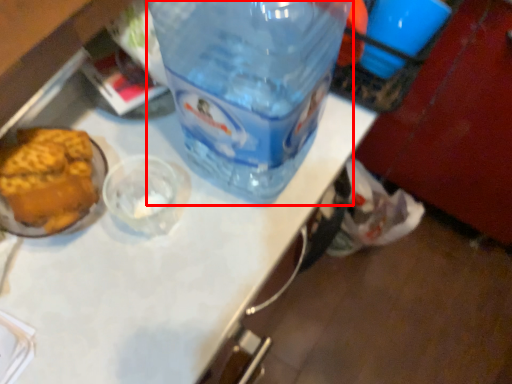
Question: From the image's perspective, considering the relative positions of bottle (annotated by the red box) and table top in the image provided, where is bottle (annotated by the red box) located with respect to the staircase?

Choices:
 (A) above
 (B) below

Answer: (A)